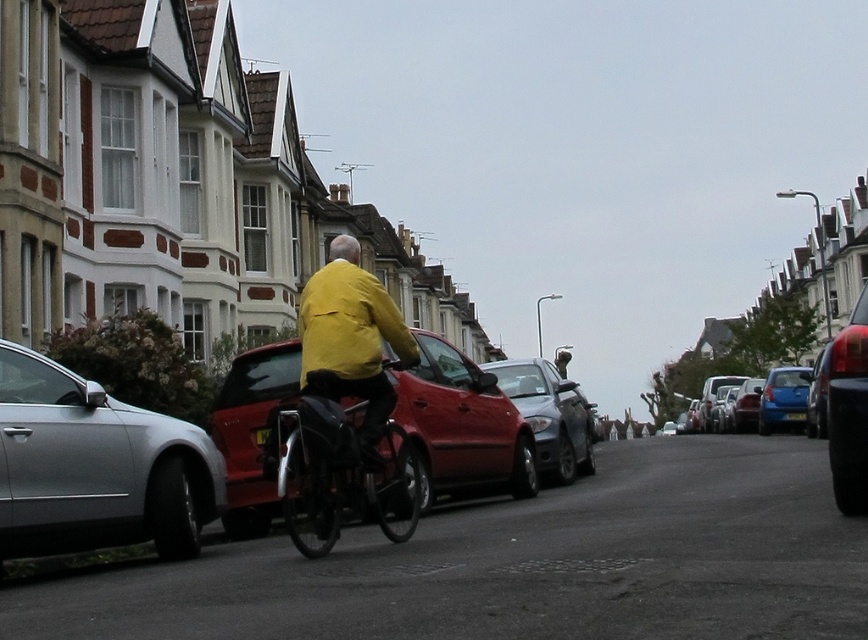
Where is `metallic silver bicycle at center`? The width and height of the screenshot is (868, 640). metallic silver bicycle at center is located at coordinates (339, 474).

Is metallic silver bicycle at center behind metallic silver sedan at center right?

No, it is not.

Is point (308, 518) closer to camera compared to point (753, 417)?

Yes, point (308, 518) is closer to viewer.

Locate an element on the screen. This screenshot has width=868, height=640. metallic silver bicycle at center is located at coordinates (339, 474).

Is silver metallic sedan at left to the left of yellow matte jacket at center from the viewer's perspective?

Correct, you'll find silver metallic sedan at left to the left of yellow matte jacket at center.

Does silver metallic sedan at left lie in front of yellow matte jacket at center?

That is True.

Locate an element on the screen. This screenshot has height=640, width=868. silver metallic sedan at left is located at coordinates (95, 467).

Is point (804, 372) positioned before point (255, 433)?

No, it is not.

You are a GUI agent. You are given a task and a screenshot of the screen. Output one action in this format:
    pyautogui.click(x=<x>, y=<y>)
    Task: Click on the blue metallic hatchback at right
    This screenshot has width=868, height=640.
    Given the screenshot: What is the action you would take?
    pyautogui.click(x=783, y=397)

At what (x,y) coordinates should I click in order to perform the action: click on blue metallic hatchback at right. Please return your answer as a coordinate pair (x, y). Image resolution: width=868 pixels, height=640 pixels. Looking at the image, I should click on (783, 397).